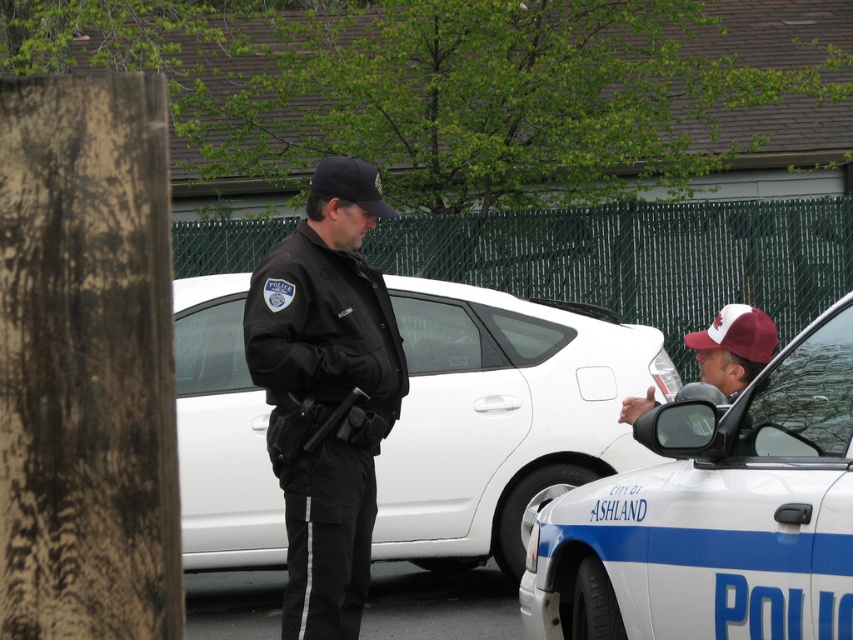
Based on the photo, you are a pedestrian standing at the edge of the parking area. You see the white glossy police car at right and the black uniform at center. Which object is nearer to you?

The white glossy police car at right is closer to the viewer than the black uniform at center, so the white glossy police car at right is nearer to you.

You are a pedestrian observing the scene from across the parking lot. You notice the black uniform at center and the maroon fabric cap at right. Which object is positioned lower in the image?

The black uniform at center is positioned lower than the maroon fabric cap at right in the image.